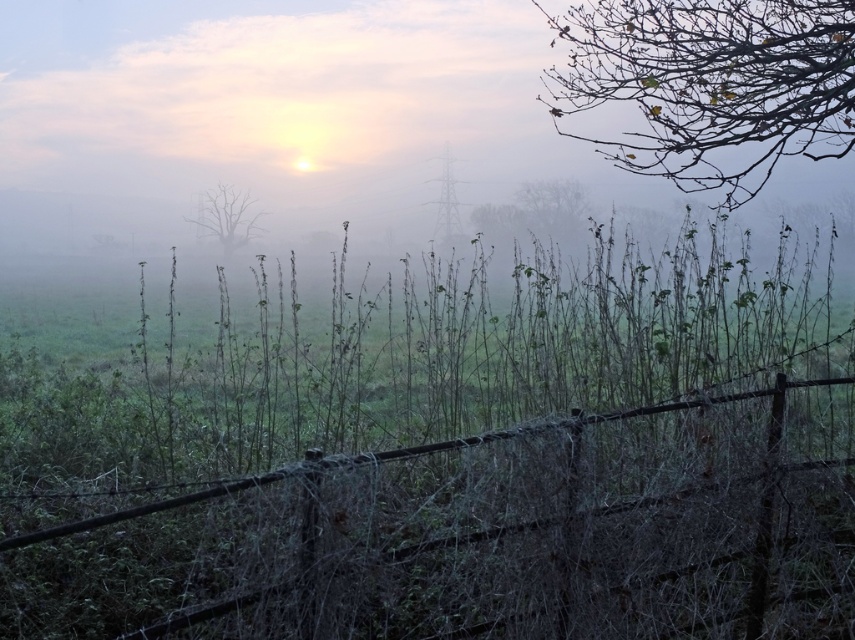
Between brown leafy branches at upper right and bare branches at center, which one has less height?

Standing shorter between the two is bare branches at center.

What are the coordinates of `brown leafy branches at upper right` in the screenshot? It's located at (711, 84).

Measure the distance between rusty wire fence at center and camera.

rusty wire fence at center is 2.44 meters away from camera.

Is rusty wire fence at center to the left of brown leafy branches at upper right from the viewer's perspective?

Correct, you'll find rusty wire fence at center to the left of brown leafy branches at upper right.

You are a GUI agent. You are given a task and a screenshot of the screen. Output one action in this format:
    pyautogui.click(x=<x>, y=<y>)
    Task: Click on the rusty wire fence at center
    
    Given the screenshot: What is the action you would take?
    pyautogui.click(x=478, y=536)

Which of these two, rusty wire fence at center or bare branches at center, stands taller?

bare branches at center is taller.

Which is above, rusty wire fence at center or bare branches at center?

bare branches at center is higher up.

Which is behind, point (447, 548) or point (226, 209)?

Positioned behind is point (226, 209).

The width and height of the screenshot is (855, 640). Find the location of `rusty wire fence at center`. rusty wire fence at center is located at coordinates click(478, 536).